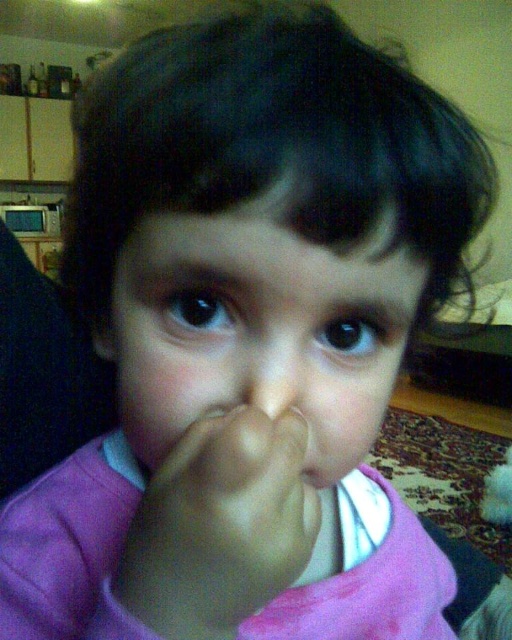
Question: Can you confirm if smooth skin face at center is wider than smooth white mouth at center?

Choices:
 (A) yes
 (B) no

Answer: (A)

Question: Which point is closer to the camera?

Choices:
 (A) (338, 262)
 (B) (309, 481)
 (C) (292, 376)

Answer: (A)

Question: Which object is farther from the camera taking this photo?

Choices:
 (A) smooth skin face at center
 (B) smooth skin nose at center

Answer: (B)

Question: Is skinny flesh-toned finger at center closer to the viewer compared to smooth skin nose at center?

Choices:
 (A) no
 (B) yes

Answer: (B)

Question: Is smooth skin face at center positioned at the back of skinny flesh-toned finger at center?

Choices:
 (A) no
 (B) yes

Answer: (B)

Question: Which point is farther to the camera?

Choices:
 (A) smooth white mouth at center
 (B) smooth skin nose at center
 (C) smooth skin face at center
 (D) skinny flesh-toned finger at center

Answer: (A)